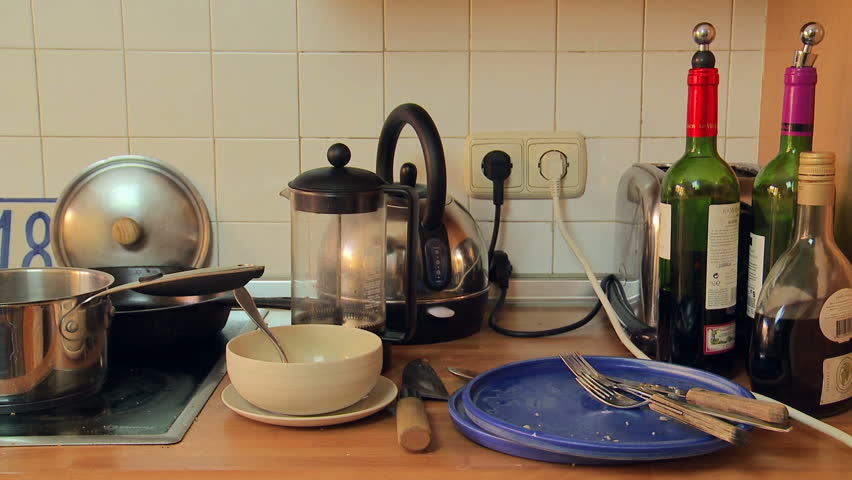
Where is `wall`? The height and width of the screenshot is (480, 852). wall is located at coordinates (520, 84).